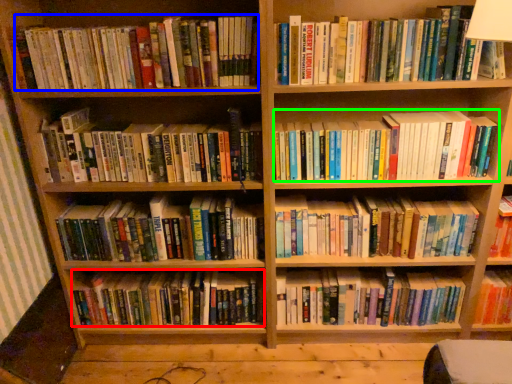
Question: Which object is positioned closest to book (highlighted by a red box)? Select from book (highlighted by a blue box) and book (highlighted by a green box).

Choices:
 (A) book
 (B) book

Answer: (B)